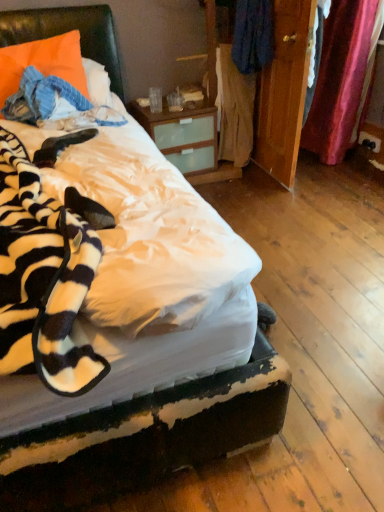
Question: Is black plastic power outlet at lower right wider than wooden wardrobe at center?

Choices:
 (A) yes
 (B) no

Answer: (B)

Question: From the image's perspective, would you say black plastic power outlet at lower right is positioned over wooden wardrobe at center?

Choices:
 (A) no
 (B) yes

Answer: (A)

Question: Is the depth of black plastic power outlet at lower right greater than that of wooden wardrobe at center?

Choices:
 (A) yes
 (B) no

Answer: (A)

Question: Does black plastic power outlet at lower right have a greater height compared to wooden wardrobe at center?

Choices:
 (A) yes
 (B) no

Answer: (B)

Question: From a real-world perspective, is black plastic power outlet at lower right on top of wooden wardrobe at center?

Choices:
 (A) no
 (B) yes

Answer: (A)

Question: Is black plastic power outlet at lower right with wooden wardrobe at center?

Choices:
 (A) no
 (B) yes

Answer: (A)

Question: Is wooden wardrobe at center turned away from black plastic power outlet at lower right?

Choices:
 (A) no
 (B) yes

Answer: (A)

Question: Can you confirm if wooden wardrobe at center is thinner than black plastic power outlet at lower right?

Choices:
 (A) yes
 (B) no

Answer: (B)

Question: From a real-world perspective, is wooden wardrobe at center beneath black plastic power outlet at lower right?

Choices:
 (A) yes
 (B) no

Answer: (B)

Question: From a real-world perspective, is wooden wardrobe at center physically above black plastic power outlet at lower right?

Choices:
 (A) no
 (B) yes

Answer: (B)

Question: Would you say wooden wardrobe at center is outside black plastic power outlet at lower right?

Choices:
 (A) yes
 (B) no

Answer: (A)

Question: Are wooden wardrobe at center and black plastic power outlet at lower right beside each other?

Choices:
 (A) yes
 (B) no

Answer: (B)

Question: From a real-world perspective, is light brown fabric at center, the 2th clothing when ordered from top to bottom, physically below black plastic power outlet at lower right?

Choices:
 (A) no
 (B) yes

Answer: (A)